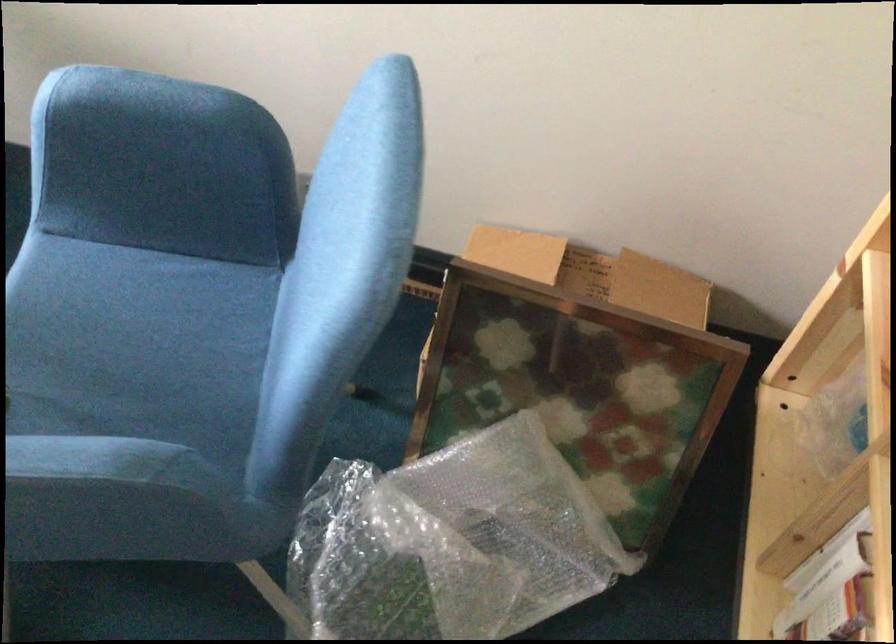
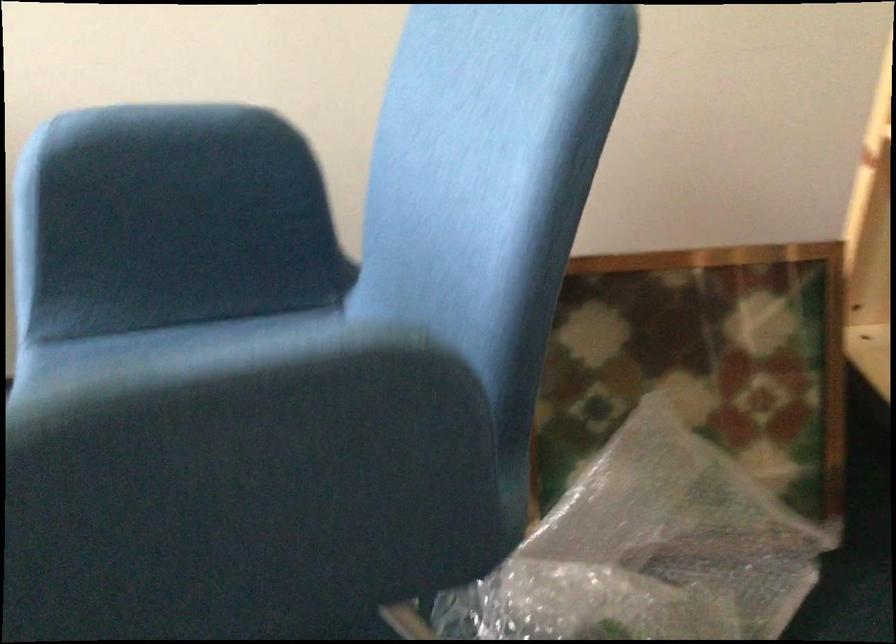
Which direction would the cameraman need to move to produce the second image?

The movement direction of the cameraman is left, forward.